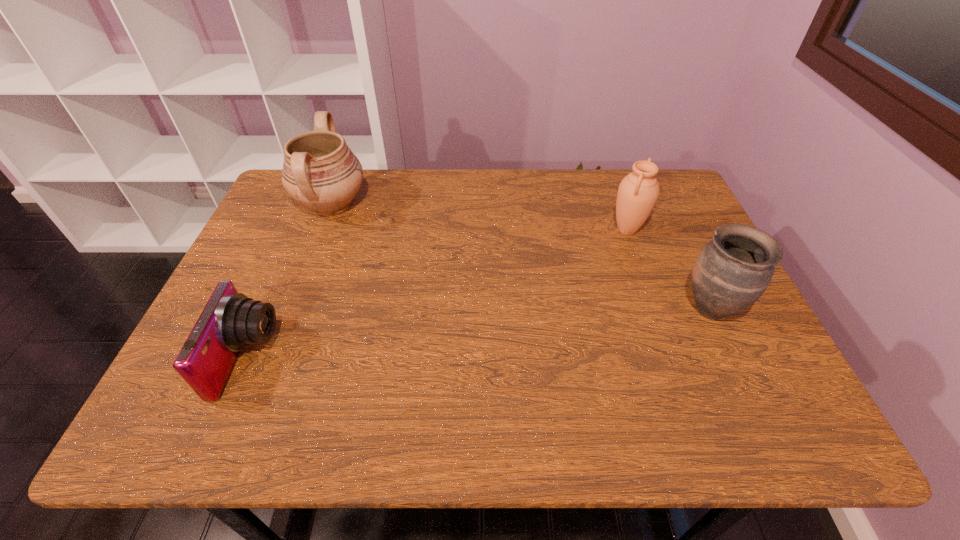
Locate an element on the screen. Image resolution: width=960 pixels, height=540 pixels. object positioned at the near edge is located at coordinates [x=230, y=321].

The image size is (960, 540). What are the coordinates of `urn at the left edge` in the screenshot? It's located at (320, 172).

At what (x,y) coordinates should I click in order to perform the action: click on camera positioned at the left edge. Please return your answer as a coordinate pair (x, y). This screenshot has height=540, width=960. Looking at the image, I should click on (230, 321).

Where is `object at the far left corner`? Image resolution: width=960 pixels, height=540 pixels. object at the far left corner is located at coordinates (320, 172).

The width and height of the screenshot is (960, 540). What are the coordinates of `object that is at the near left corner` in the screenshot? It's located at (230, 321).

Locate an element on the screen. This screenshot has height=540, width=960. vacant region at the far edge of the desktop is located at coordinates (450, 183).

I want to click on free point at the near edge, so click(705, 443).

In the image, there is a desktop. In order to click on free space at the left edge in this screenshot , I will do `click(267, 302)`.

The width and height of the screenshot is (960, 540). Identify the location of free space at the right edge. (710, 362).

This screenshot has width=960, height=540. Identify the location of vacant space at the far right corner. (677, 192).